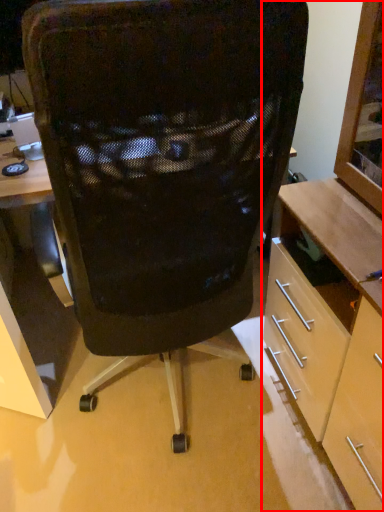
Question: From the image's perspective, where is cabinetry (annotated by the red box) located relative to chair?

Choices:
 (A) above
 (B) below

Answer: (B)